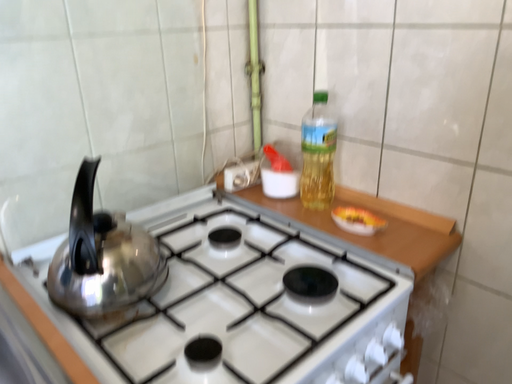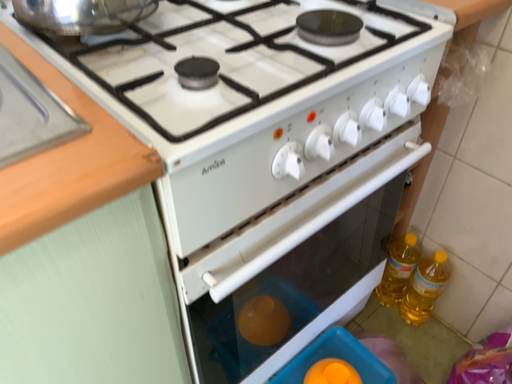
Question: How did the camera likely rotate when shooting the video?

Choices:
 (A) rotated downward
 (B) rotated upward

Answer: (A)